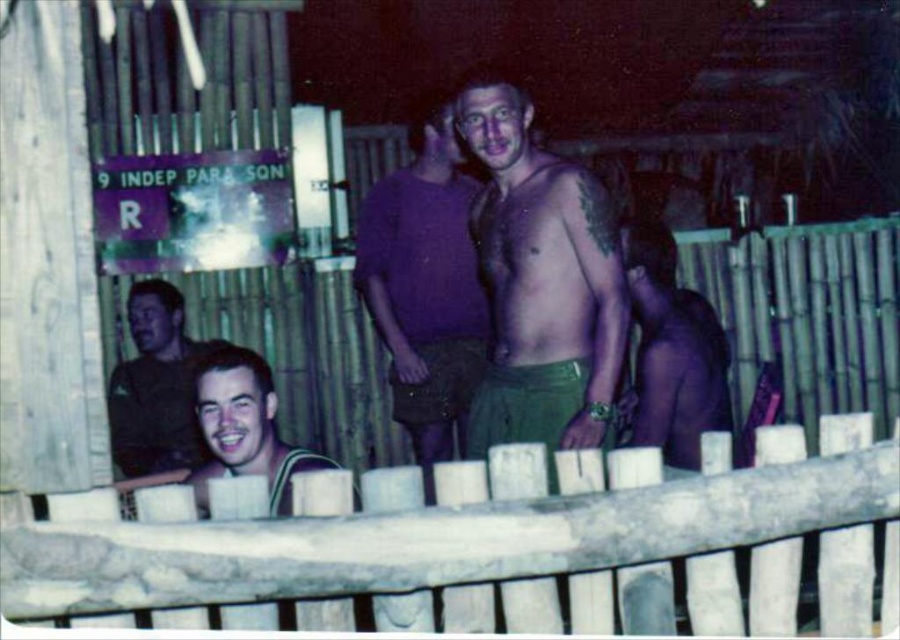
Who is positioned more to the right, purple knit sweater at center or matte brown shirt at lower left?

From the viewer's perspective, purple knit sweater at center appears more on the right side.

The image size is (900, 640). In order to click on purple knit sweater at center in this screenshot , I will do `click(426, 285)`.

Is point (464, 180) positioned behind point (158, 412)?

No, (464, 180) is closer to viewer.

This screenshot has width=900, height=640. Identify the location of purple knit sweater at center. 426,285.

Which of these two, white wood fence at lower center or shiny purple shirt at center, stands taller?

shiny purple shirt at center

Who is more distant from viewer, [726,586] or [693,365]?

Positioned behind is point [693,365].

In order to click on white wood fence at lower center in this screenshot , I will do `click(495, 545)`.

From the picture: Does matte brown shirt at lower left appear over green jersey at center?

Yes.

Which is behind, point (171, 420) or point (331, 465)?

The point (171, 420) is behind.

This screenshot has height=640, width=900. What are the coordinates of `matte brown shirt at lower left` in the screenshot? It's located at (155, 387).